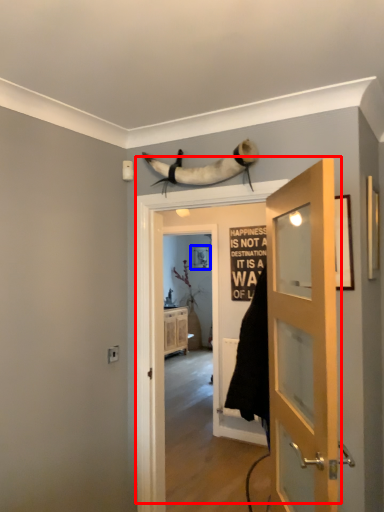
Question: Which object is closer to the camera taking this photo, door (highlighted by a red box) or picture frame (highlighted by a blue box)?

Choices:
 (A) door
 (B) picture frame

Answer: (A)